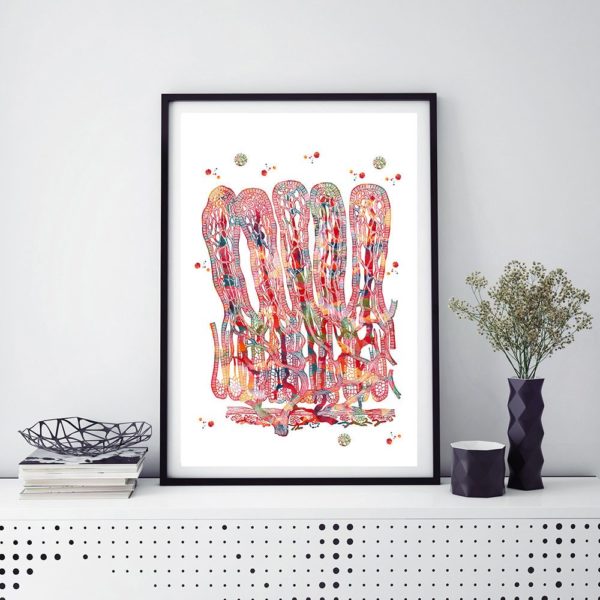
This screenshot has height=600, width=600. Find the location of `cup`. cup is located at coordinates (473, 466).